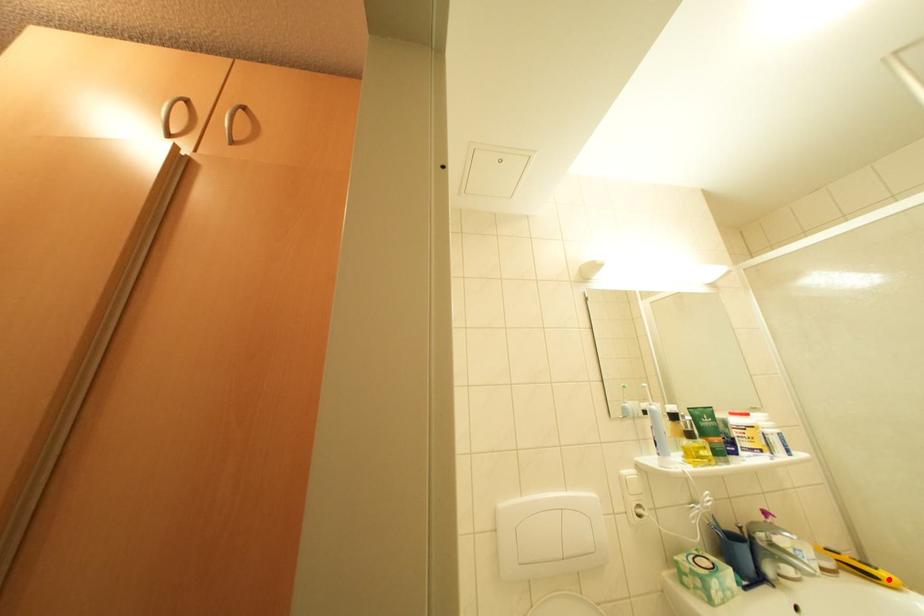
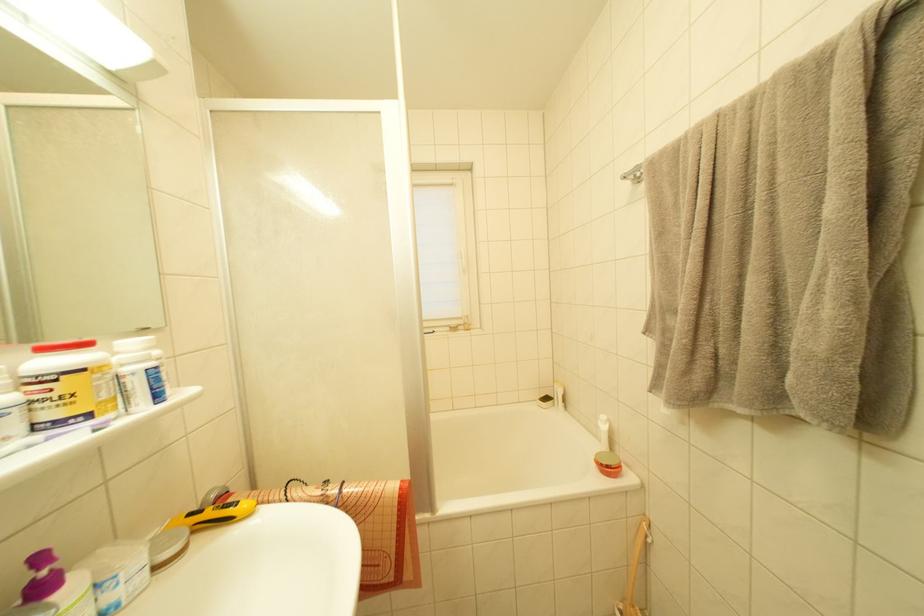
Question: I am providing you with two images of the same scene from different viewpoints. In image1, a red point is highlighted. Considering the same 3D point in image2, which of the following is correct?

Choices:
 (A) It is closer
 (B) It is farther

Answer: (B)